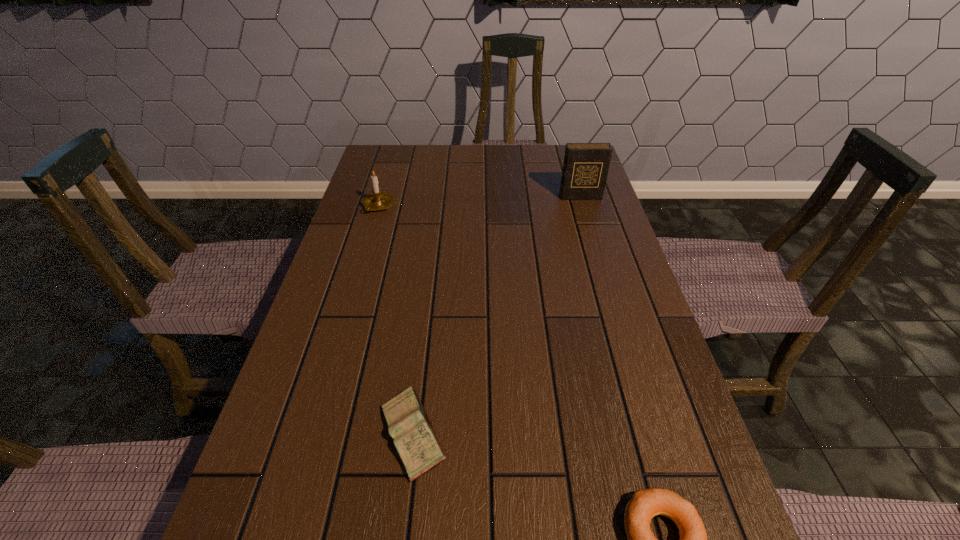
This screenshot has height=540, width=960. Identify the location of object that is the second closest to the candle holder. (414, 437).